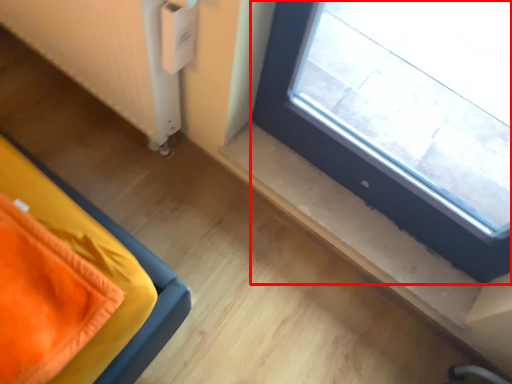
Question: Observing the image, what is the correct spatial positioning of window (annotated by the red box) in reference to radiator?

Choices:
 (A) left
 (B) right

Answer: (B)